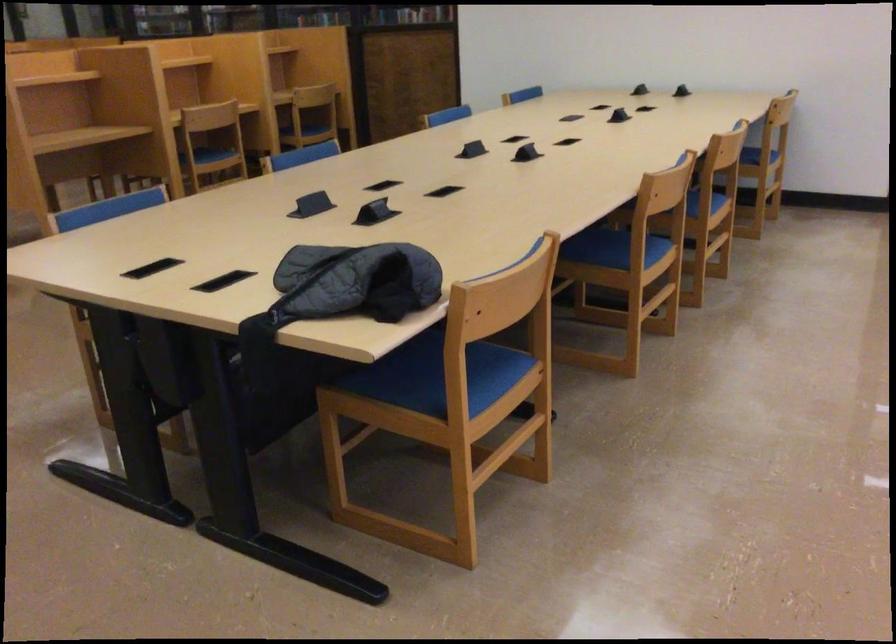
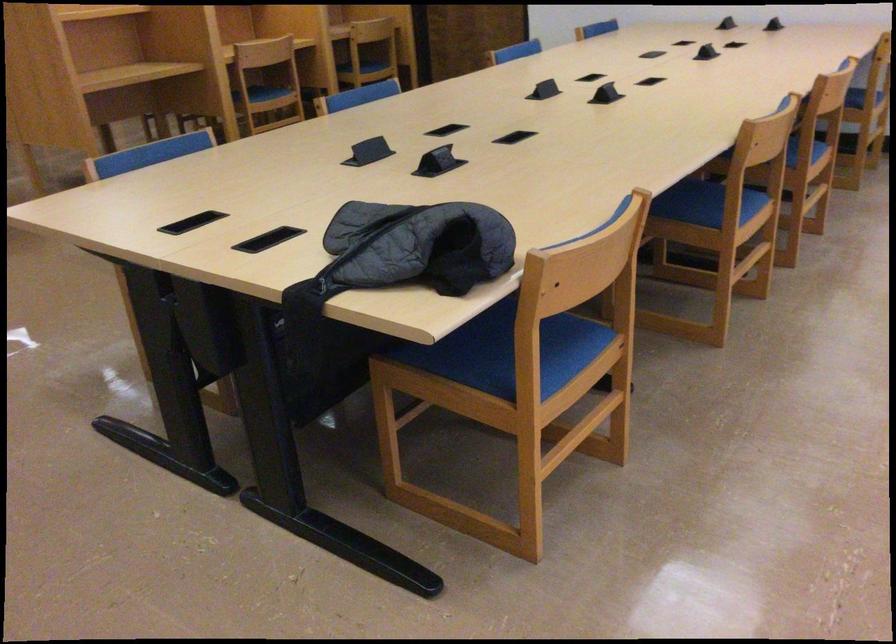
In the second image, find the point that corresponds to (x=755, y=153) in the first image.

(869, 90)